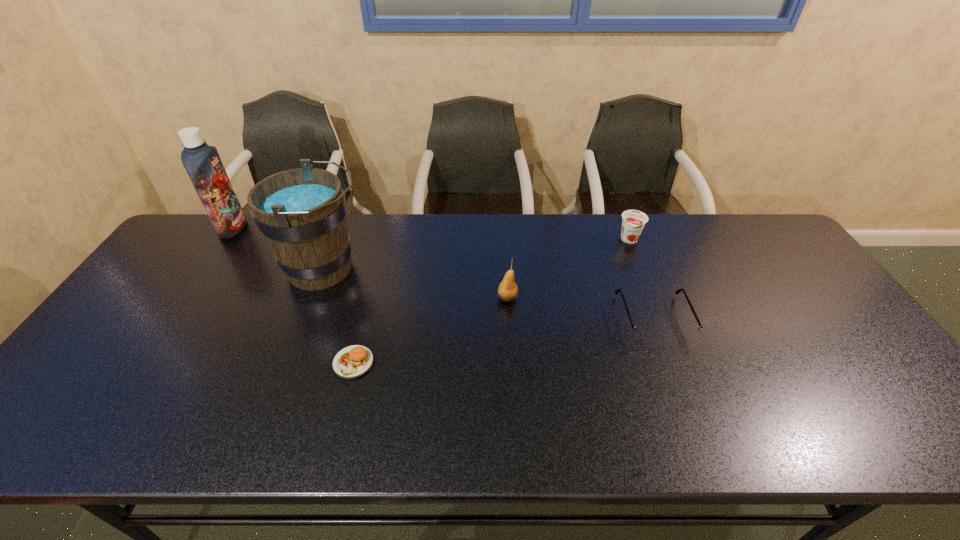
This screenshot has width=960, height=540. I want to click on vacant space located on the right of the third tallest object, so click(x=655, y=298).

Find the location of a particular element. This screenshot has width=960, height=540. blank space located 0.240m on the front of the fourth tallest object is located at coordinates (655, 303).

Identify the location of free space located 0.060m at the hinge ends of the spectacles. (671, 364).

Image resolution: width=960 pixels, height=540 pixels. I want to click on free location located on the back of the patty, so tap(376, 272).

You are a GUI agent. You are given a task and a screenshot of the screen. Output one action in this format:
    pyautogui.click(x=<x>, y=<y>)
    Task: Click on the shampoo that is at the far edge
    Image resolution: width=960 pixels, height=540 pixels.
    Given the screenshot: What is the action you would take?
    pyautogui.click(x=202, y=162)

You are a GUI agent. You are given a task and a screenshot of the screen. Output one action in this format:
    pyautogui.click(x=<x>, y=<y>)
    Task: Click on the wine bucket located in the far edge section of the desktop
    This screenshot has height=540, width=960.
    Given the screenshot: What is the action you would take?
    pyautogui.click(x=301, y=212)

Locate an element on the screen. The height and width of the screenshot is (540, 960). yogurt positioned at the far edge is located at coordinates (633, 221).

Locate an element on the screen. object present at the left edge is located at coordinates (202, 162).

You are a GUI agent. You are given a task and a screenshot of the screen. Output one action in this format:
    pyautogui.click(x=<x>, y=<y>)
    Task: Click on the object situated at the far left corner
    The image size is (960, 540).
    Given the screenshot: What is the action you would take?
    pyautogui.click(x=202, y=162)

This screenshot has width=960, height=540. Find the location of `vacant area at the far edge of the desktop`. vacant area at the far edge of the desktop is located at coordinates (478, 232).